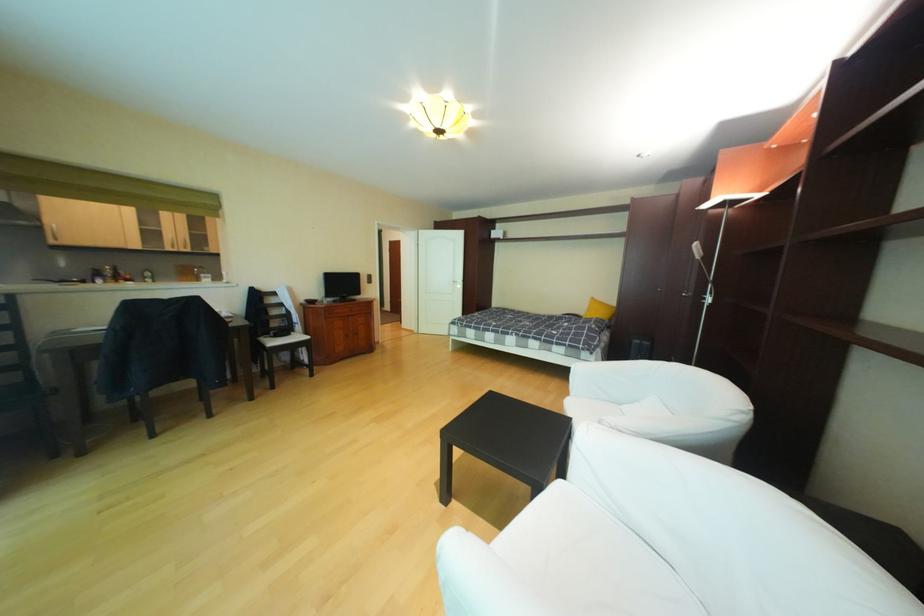
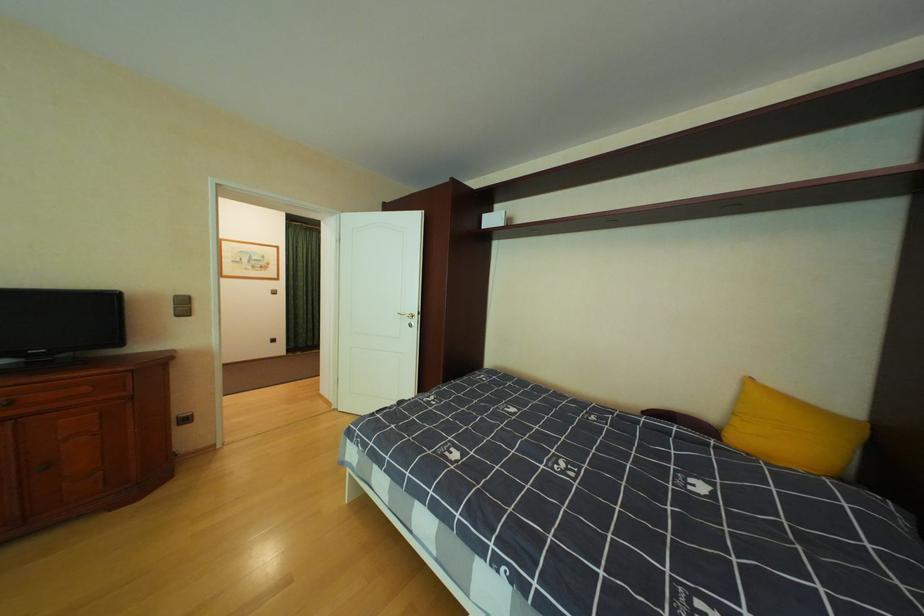
Question: In a continuous first-person perspective shot, in which direction is the camera moving?

Choices:
 (A) Left
 (B) Right
 (C) Forward
 (D) Backward

Answer: (C)